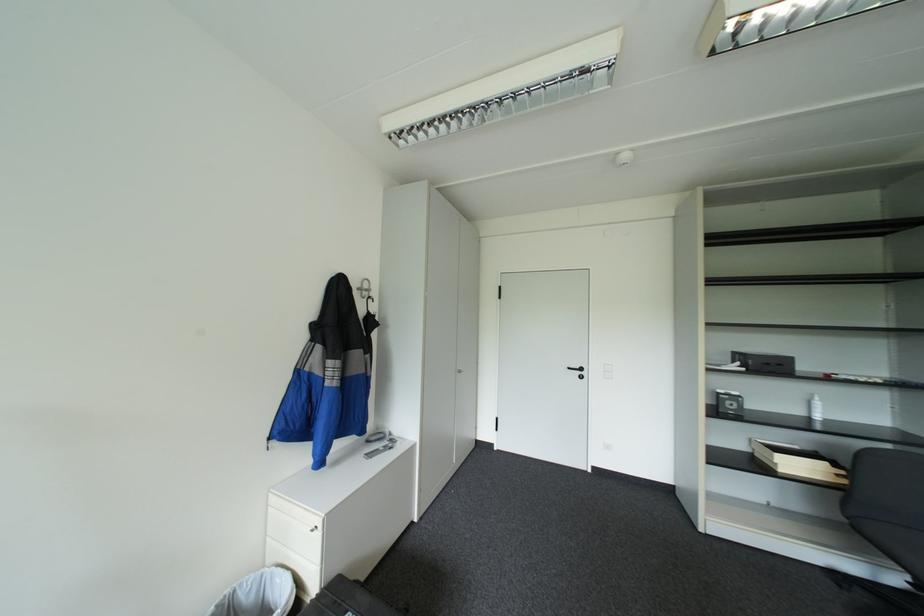
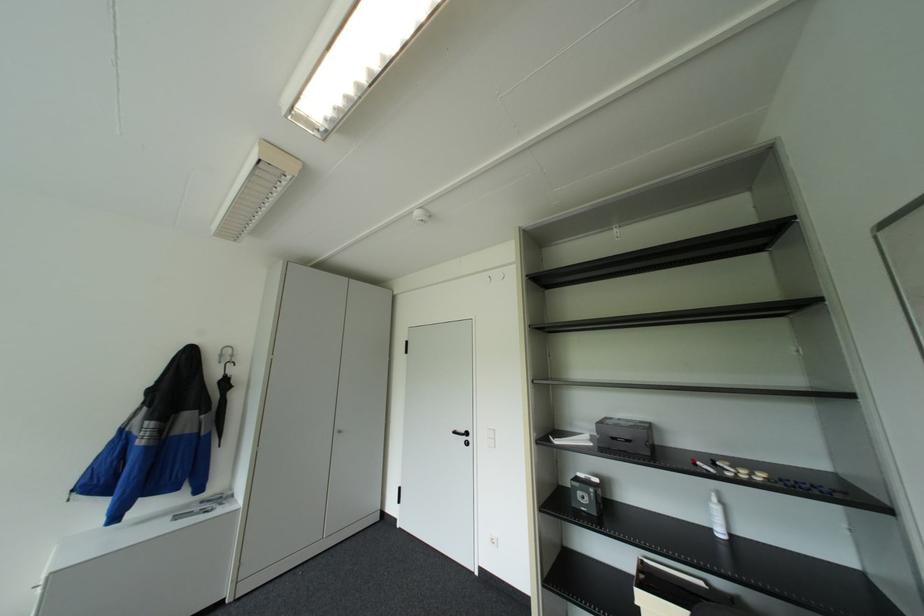
Find the pixel in the second image that matches point 578,367 in the first image.

(463, 431)